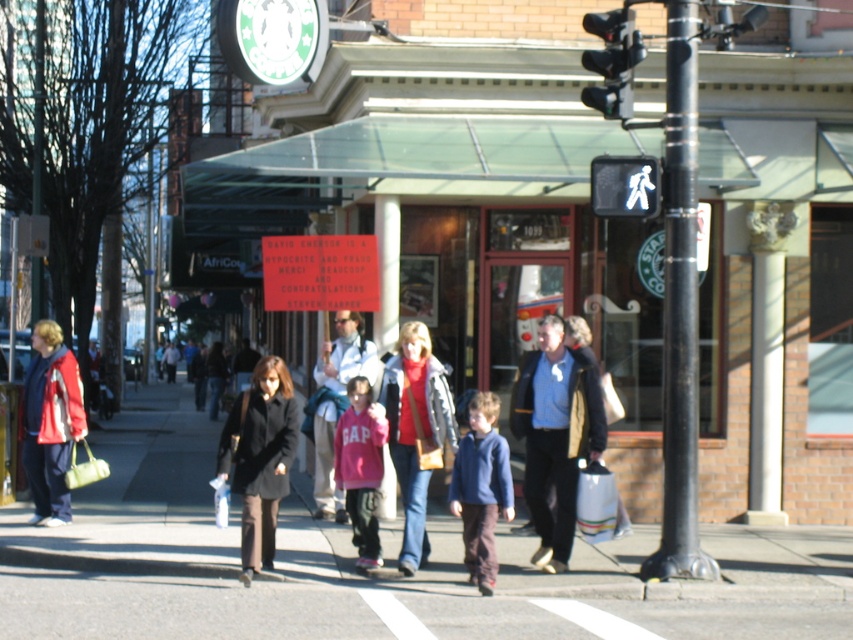
In the scene shown: Can you confirm if black metal pole at center is smaller than dark brown wool coat at center?

Actually, black metal pole at center might be larger than dark brown wool coat at center.

Does black metal pole at center have a lesser width compared to dark brown wool coat at center?

Yes, black metal pole at center is thinner than dark brown wool coat at center.

This screenshot has height=640, width=853. What do you see at coordinates (680, 308) in the screenshot? I see `black metal pole at center` at bounding box center [680, 308].

This screenshot has height=640, width=853. What are the coordinates of `black metal pole at center` in the screenshot? It's located at (680, 308).

Is blue fleece jacket at center shorter than pink fleece jacket at center?

Yes, blue fleece jacket at center is shorter than pink fleece jacket at center.

Image resolution: width=853 pixels, height=640 pixels. Describe the element at coordinates (480, 490) in the screenshot. I see `blue fleece jacket at center` at that location.

Find the location of a particular element. Image resolution: width=853 pixels, height=640 pixels. blue fleece jacket at center is located at coordinates (480, 490).

Who is higher up, matte red jacket at center or matte red jacket at left?

matte red jacket at left is above.

This screenshot has width=853, height=640. What do you see at coordinates (415, 429) in the screenshot?
I see `matte red jacket at center` at bounding box center [415, 429].

Is point (397, 461) positioned after point (47, 449)?

No, (397, 461) is in front of (47, 449).

Where is `matte red jacket at center`? matte red jacket at center is located at coordinates (415, 429).